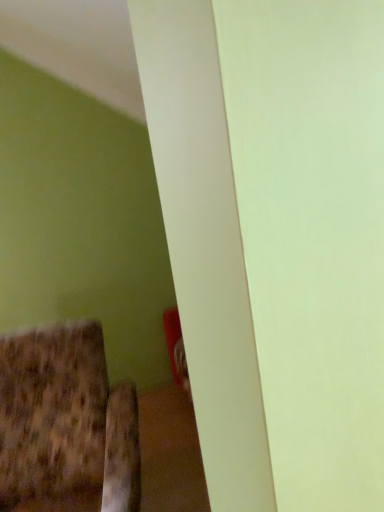
I want to click on wooden chair at lower left, so (66, 425).

This screenshot has height=512, width=384. What do you see at coordinates (66, 425) in the screenshot?
I see `wooden chair at lower left` at bounding box center [66, 425].

Image resolution: width=384 pixels, height=512 pixels. What are the coordinates of `wooden chair at lower left` in the screenshot? It's located at (66, 425).